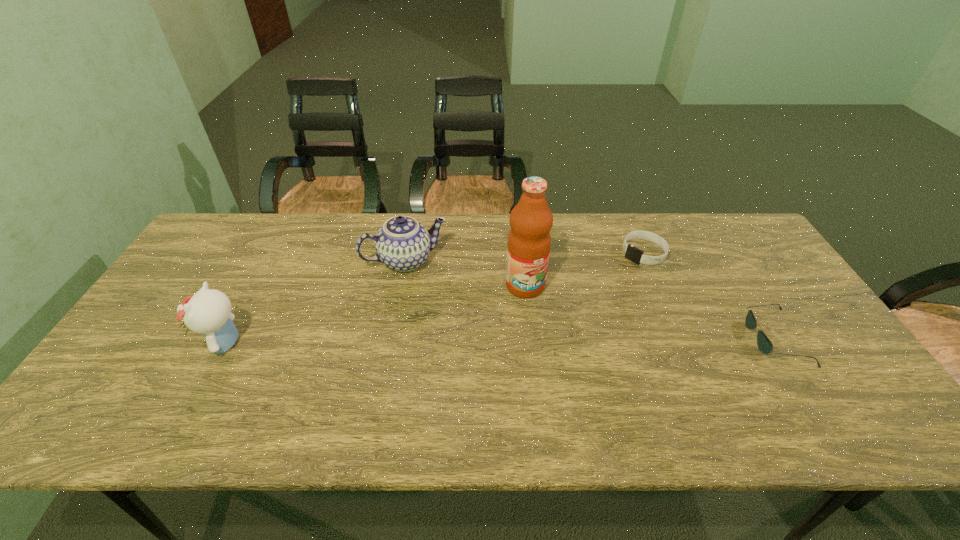
This screenshot has height=540, width=960. In order to click on vacant space on the desktop that is between the kitten and the rightmost object and is positioned on the outer surface of the fourth object from left to right in this screenshot , I will do `click(521, 340)`.

Where is `vacant space on the desktop that is between the leftmost object and the rightmost object and is positioned at the spout of the second object from left to right`? This screenshot has height=540, width=960. vacant space on the desktop that is between the leftmost object and the rightmost object and is positioned at the spout of the second object from left to right is located at coordinates (436, 341).

Identify the location of vacant space on the desktop that is between the kitten and the sunglasses and is positioned on the front label of the third object from left to right. (554, 340).